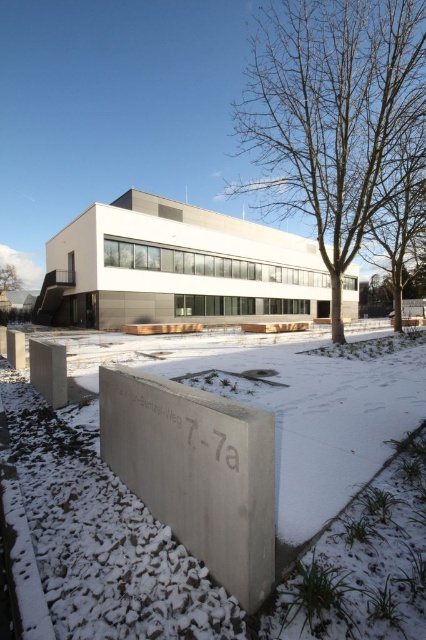
You are standing at the entrance of the modern building and want to find the tree. According to the image, where is the bare wood tree at center located relative to the building?

The bare wood tree at center is located at the center of the image, positioned at coordinates approximately 0.180 on the x axis and 0.779 on the y axis.

You are standing in front of the modern building and notice two trees. The first is a bare wood tree at center, and the second is a brown wood tree at upper left. From your vantage point, which tree appears closer to you?

The bare wood tree at center appears closer to you because it is positioned over the brown wood tree at upper left, indicating it is in front of it.

Looking at the snowy scene, you see a bare wood tree at center and a brown wood tree at upper left. Which tree is bigger?

The bare wood tree at center is larger in size than the brown wood tree at upper left.